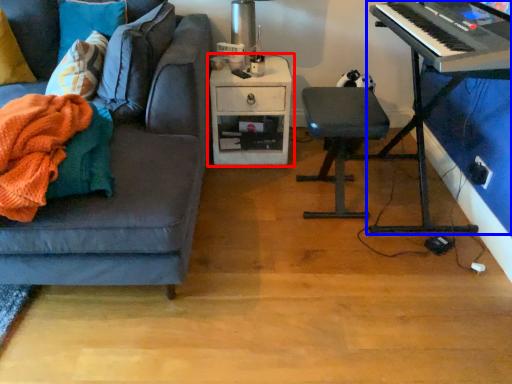
Question: Which point is further to the camera, table (highlighted by a red box) or piano (highlighted by a blue box)?

Choices:
 (A) table
 (B) piano

Answer: (A)